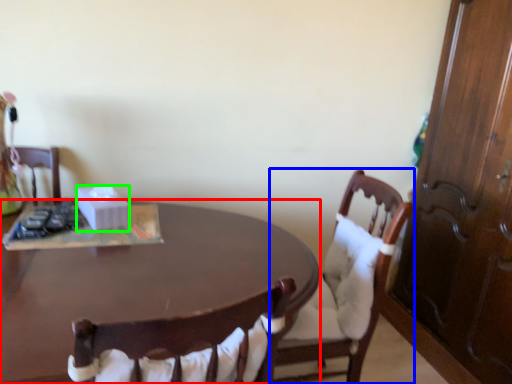
Question: Considering the real-world distances, which object is closest to desk (highlighted by a red box)? chair (highlighted by a blue box) or box (highlighted by a green box).

Choices:
 (A) chair
 (B) box

Answer: (B)